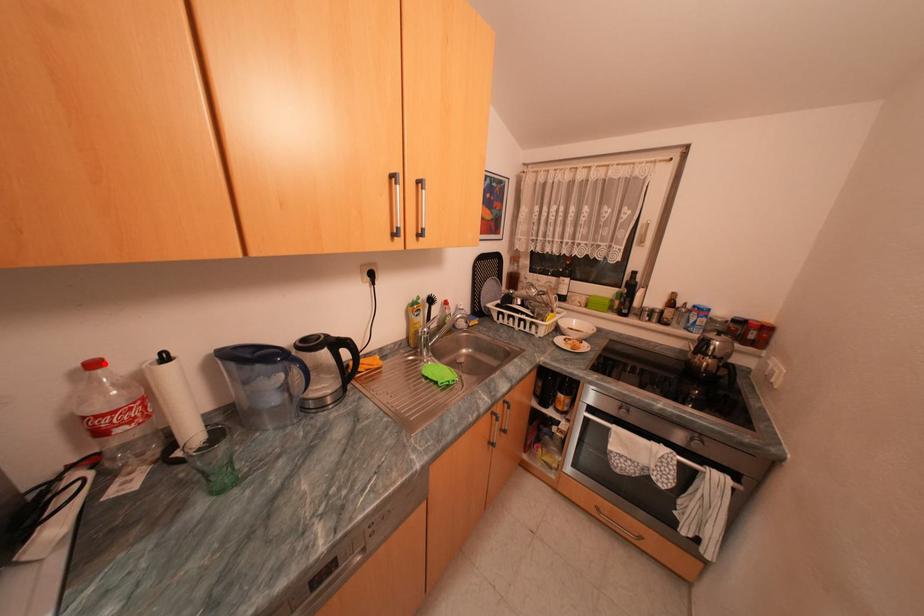
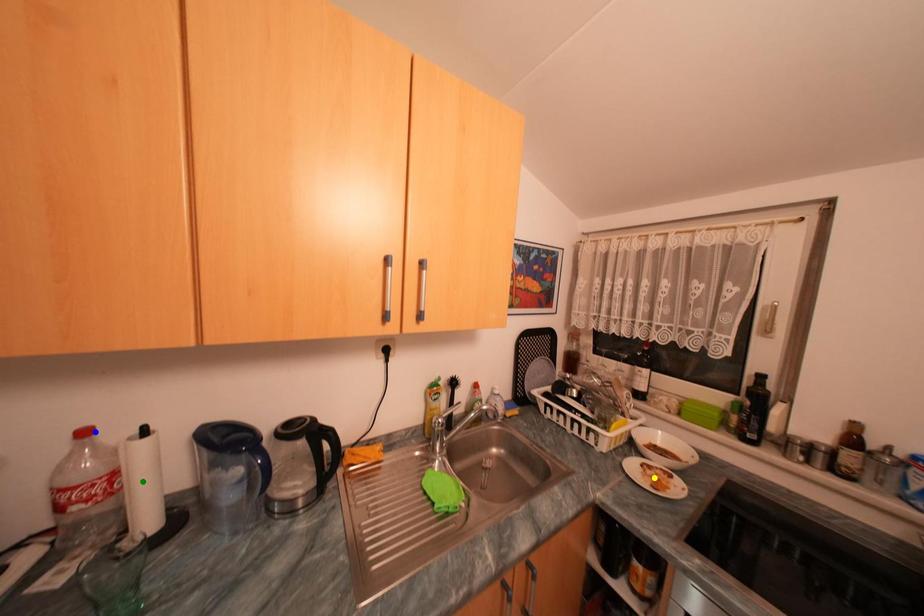
Question: I am providing you with two images of the same scene from different viewpoints. A red point is marked on the first image. You are given multiple points on the second image. Can you choose the point in image 2 that corresponds to the point in image 1?

Choices:
 (A) green point
 (B) yellow point
 (C) blue point

Answer: (C)